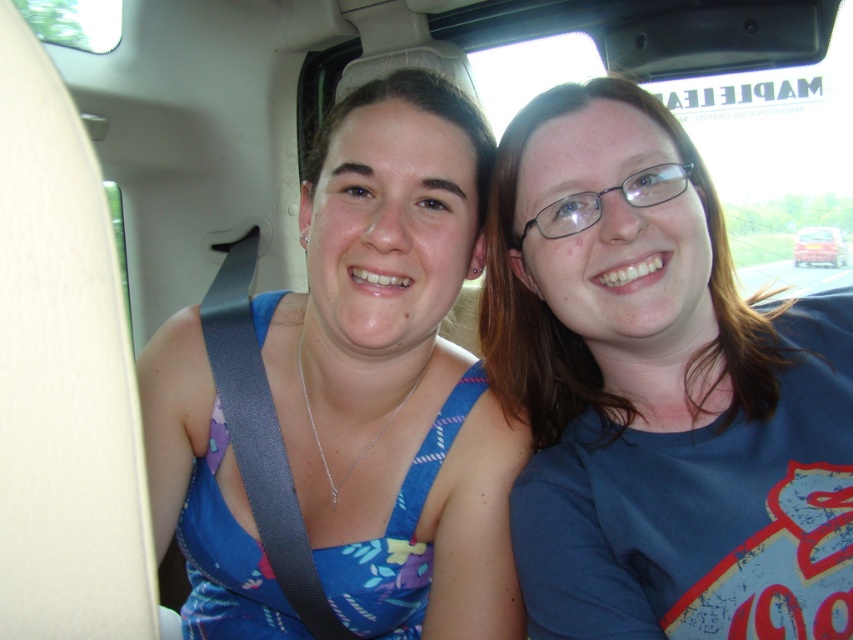
You are a passenger in the backseat of a car and need to hand a small item to the person wearing the blue cotton shirt at center. The item is currently on the blue fabric dress at center. Can you reach it without moving your body?

The blue cotton shirt at center is 9.12 inches away from the blue fabric dress at center. Since the distance is relatively short, you can likely reach the item without moving your body.

You are a photographer trying to capture a clear photo of the blue cotton shirt at center from your current position. Considering the camera lens has a minimum focusing distance of 30 inches, will you be able to take a sharp photo?

The blue cotton shirt at center is 32.07 inches away from the camera, which is beyond the minimum focusing distance of 30 inches. Therefore, the photographer can take a sharp photo as the distance is sufficient.

You are a passenger in the car and need to reach the blue cotton shirt at center to grab a phone from the pocket. Can you reach it while staying seated?

The blue cotton shirt at center is located at point (659,392), which is within typical seating positions, so yes, you can likely reach it while staying seated.